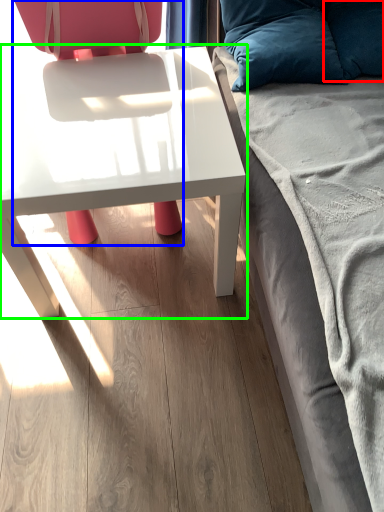
Question: Based on their relative distances, which object is nearer to pillow (highlighted by a red box)? Choose from chair (highlighted by a blue box) and table (highlighted by a green box).

Choices:
 (A) chair
 (B) table

Answer: (B)